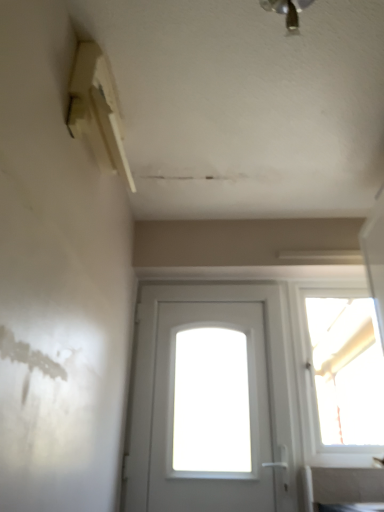
Question: Is metallic ceiling light at upper center oriented away from white matte door at center?

Choices:
 (A) no
 (B) yes

Answer: (A)

Question: Could you tell me if metallic ceiling light at upper center is facing white matte door at center?

Choices:
 (A) no
 (B) yes

Answer: (A)

Question: Does metallic ceiling light at upper center lie in front of white matte door at center?

Choices:
 (A) no
 (B) yes

Answer: (B)

Question: Considering the relative sizes of metallic ceiling light at upper center and white matte door at center in the image provided, is metallic ceiling light at upper center wider than white matte door at center?

Choices:
 (A) yes
 (B) no

Answer: (A)

Question: Is metallic ceiling light at upper center outside white matte door at center?

Choices:
 (A) yes
 (B) no

Answer: (A)

Question: Is metallic ceiling light at upper center further to camera compared to white matte door at center?

Choices:
 (A) no
 (B) yes

Answer: (A)

Question: Can you confirm if transparent glass window at upper right is positioned to the right of metallic ceiling light at upper center?

Choices:
 (A) no
 (B) yes

Answer: (B)

Question: From the image's perspective, is transparent glass window at upper right located beneath metallic ceiling light at upper center?

Choices:
 (A) yes
 (B) no

Answer: (A)

Question: Is transparent glass window at upper right not inside metallic ceiling light at upper center?

Choices:
 (A) no
 (B) yes

Answer: (B)

Question: Is metallic ceiling light at upper center inside transparent glass window at upper right?

Choices:
 (A) no
 (B) yes

Answer: (A)

Question: Does transparent glass window at upper right have a greater width compared to metallic ceiling light at upper center?

Choices:
 (A) no
 (B) yes

Answer: (A)

Question: Is transparent glass window at upper right aimed at metallic ceiling light at upper center?

Choices:
 (A) yes
 (B) no

Answer: (A)

Question: From a real-world perspective, is white matte door at center on metallic ceiling light at upper center?

Choices:
 (A) no
 (B) yes

Answer: (A)